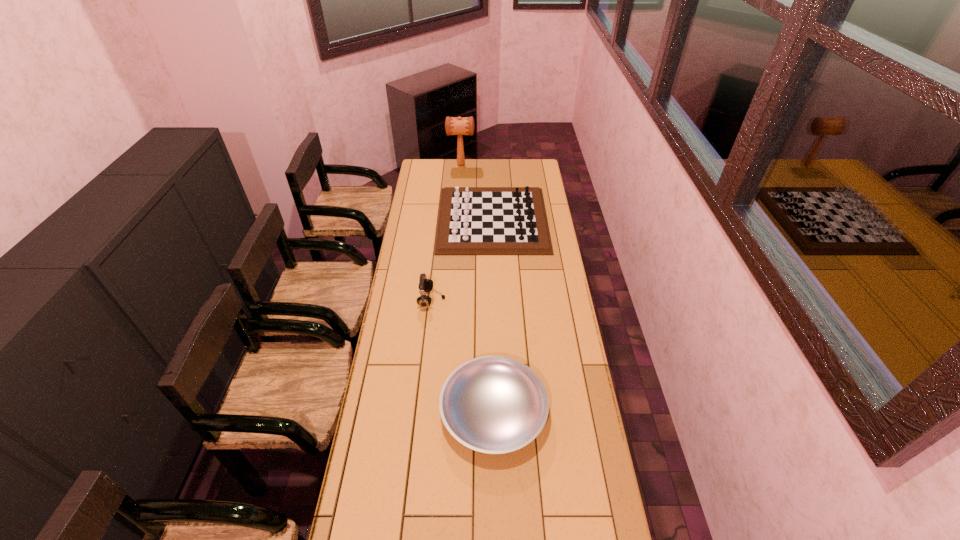
The width and height of the screenshot is (960, 540). I want to click on the tallest object, so click(459, 126).

Where is `mallet`? mallet is located at coordinates (459, 126).

Locate an element on the screen. the second nearest object is located at coordinates (425, 285).

This screenshot has width=960, height=540. I want to click on the second tallest object, so click(425, 285).

Where is `the second shortest object`? The height and width of the screenshot is (540, 960). the second shortest object is located at coordinates (472, 220).

Where is `the second farthest object`? the second farthest object is located at coordinates (472, 220).

This screenshot has width=960, height=540. In order to click on the shortest object in this screenshot , I will do `click(492, 404)`.

Where is `the nearest object`? The height and width of the screenshot is (540, 960). the nearest object is located at coordinates (492, 404).

Locate an element on the screen. The image size is (960, 540). free space located 0.240m on the strike surface of the tallest object is located at coordinates (513, 165).

I want to click on vacant space situated 0.130m with the microphone on the side of the third farthest object, so click(474, 300).